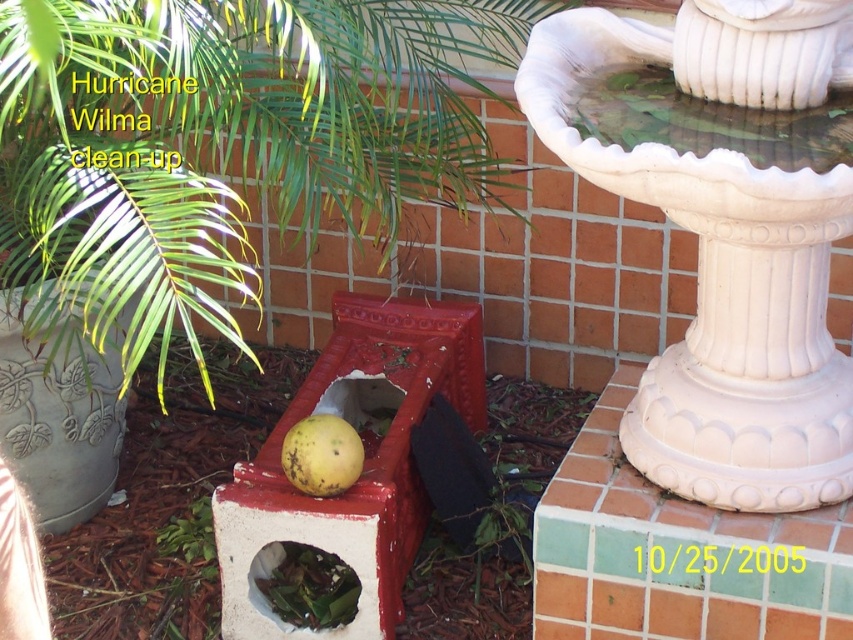
Question: Does green leafy plant at center appear over green leafy debris at center?

Choices:
 (A) no
 (B) yes

Answer: (B)

Question: In this image, where is white ceramic fountain at upper right located relative to yellow matte fruit at center?

Choices:
 (A) left
 (B) right

Answer: (B)

Question: Which point appears farthest from the camera in this image?

Choices:
 (A) (4, 161)
 (B) (604, 104)
 (C) (320, 573)
 (D) (346, 486)

Answer: (C)

Question: Estimate the real-world distances between objects in this image. Which object is closer to the green leafy debris at center?

Choices:
 (A) white ceramic fountain at upper right
 (B) yellow matte fruit at center

Answer: (B)

Question: Which point is farther from the camera taking this photo?

Choices:
 (A) (325, 600)
 (B) (828, 99)

Answer: (A)

Question: Does green leafy debris at center come in front of yellow matte fruit at center?

Choices:
 (A) no
 (B) yes

Answer: (A)